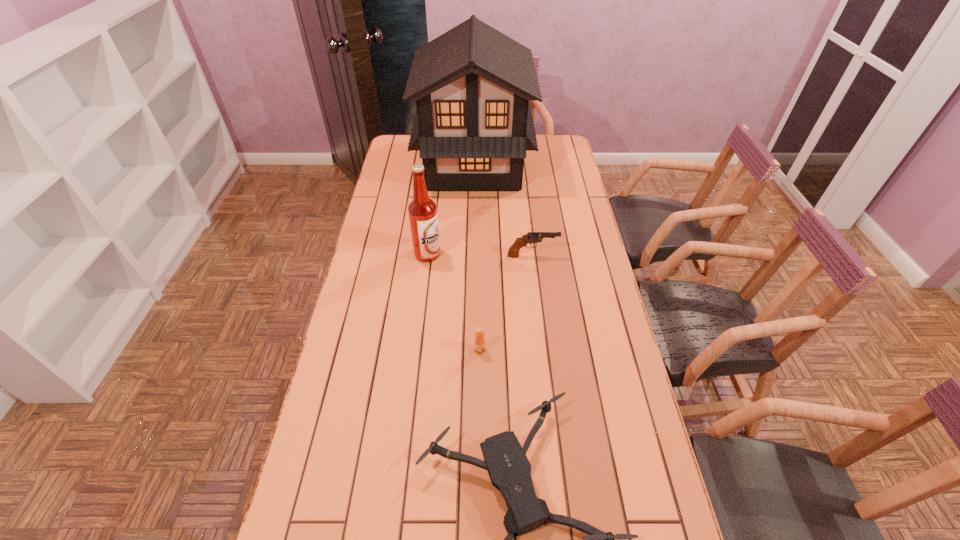
I want to click on the farthest object, so click(x=473, y=124).

Find the location of a particular element. This screenshot has width=960, height=540. the tallest object is located at coordinates (473, 124).

At what (x,y) coordinates should I click in order to perform the action: click on alcohol. Please return your answer as a coordinate pair (x, y). The height and width of the screenshot is (540, 960). Looking at the image, I should click on (422, 211).

The height and width of the screenshot is (540, 960). In order to click on gun in this screenshot , I will do `click(531, 237)`.

Image resolution: width=960 pixels, height=540 pixels. What are the coordinates of `orange juice` in the screenshot? It's located at (479, 339).

The height and width of the screenshot is (540, 960). I want to click on free region located on the front-facing side of the dollhouse, so click(548, 165).

At what (x,y) coordinates should I click in order to perform the action: click on free region located 0.310m on the label side of the second tallest object. Please return your answer as a coordinate pair (x, y). Looking at the image, I should click on (526, 254).

Image resolution: width=960 pixels, height=540 pixels. Find the location of `free region located along the barrel of the gun`. free region located along the barrel of the gun is located at coordinates (596, 256).

This screenshot has height=540, width=960. Find the location of `vacant region located on the front label of the second nearest object`. vacant region located on the front label of the second nearest object is located at coordinates (480, 404).

You are a GUI agent. You are given a task and a screenshot of the screen. Output one action in this format:
    pyautogui.click(x=<x>, y=<y>)
    Task: Click on the object positioned at the far edge
    This screenshot has width=960, height=540.
    Given the screenshot: What is the action you would take?
    pyautogui.click(x=473, y=124)